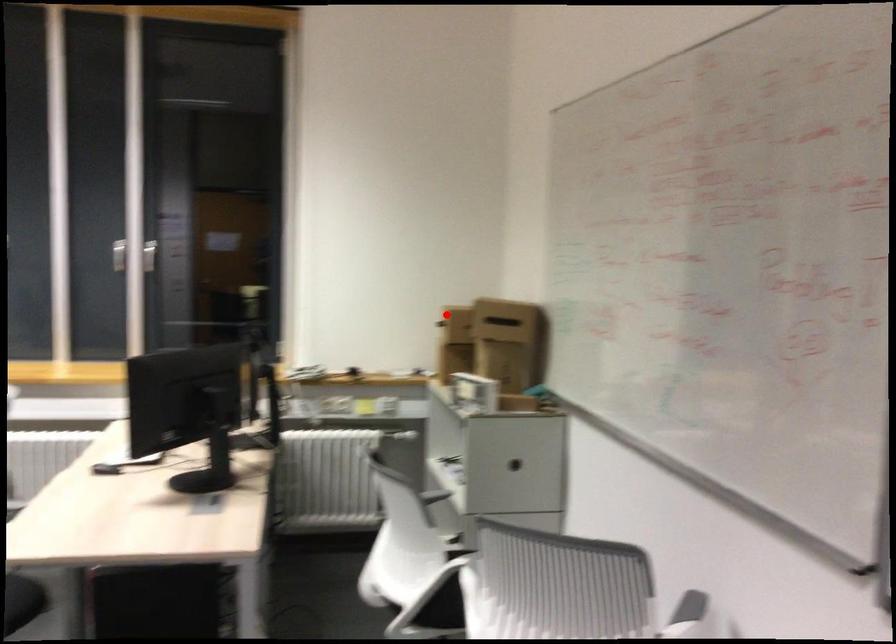
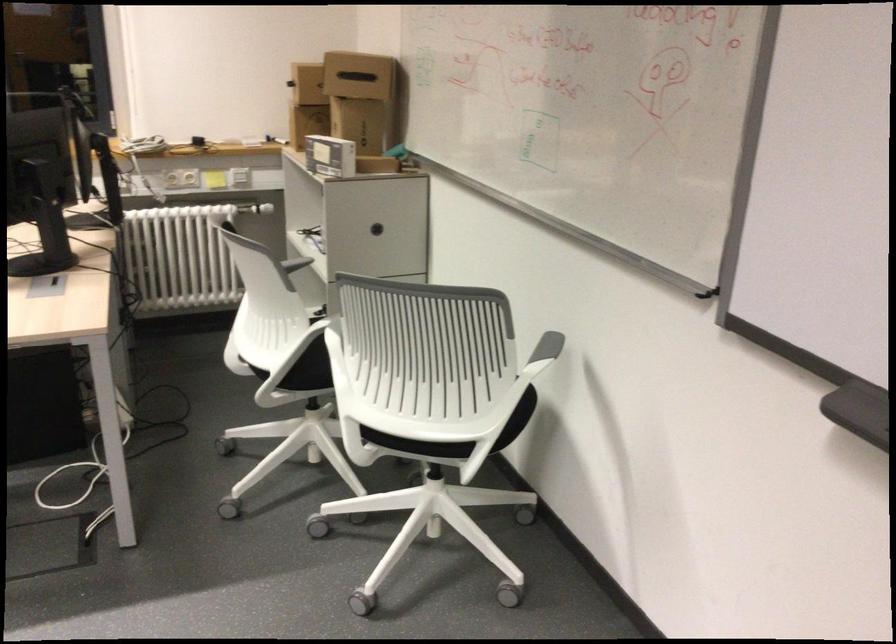
The point at the highlighted location is marked in the first image. Where is the corresponding point in the second image?

(307, 84)